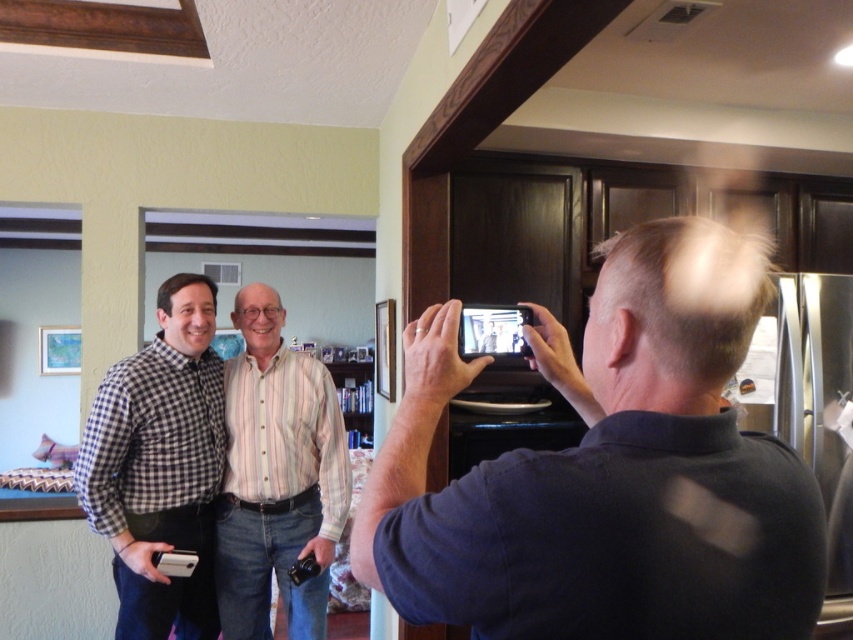
You are a photographer trying to capture a closeup shot of the checkered fabric shirt at left. The matte black phone at center is your only camera. Considering their sizes, will the phone be able to capture the entire shirt in one shot?

The matte black phone at center has a smaller size compared to checkered fabric shirt at left, so it may not be able to capture the entire shirt in one shot without zooming or moving closer.

You are a photographer trying to capture a group photo of the two men wearing the checkered fabric shirt at left and the striped cotton shirt at center. Since you want to ensure both subjects are in focus, which one should you focus on first?

You should focus on the checkered fabric shirt at left first because it is closer to the viewer than the striped cotton shirt at center, so adjusting focus from near to far will help both be in focus.

You are a photographer trying to capture a group photo. You have a matte black phone at center and a striped cotton shirt at center in your frame. Which object is wider?

The matte black phone at center is wider than the striped cotton shirt at center.